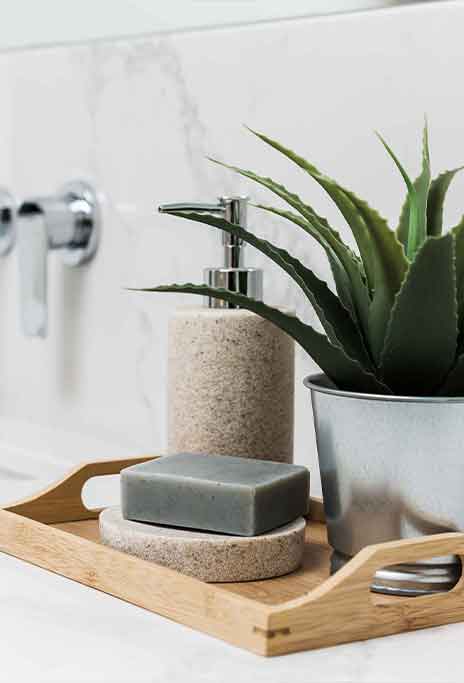
Where is `holes of wooden tray handles`? holes of wooden tray handles is located at coordinates (385, 600), (107, 488).